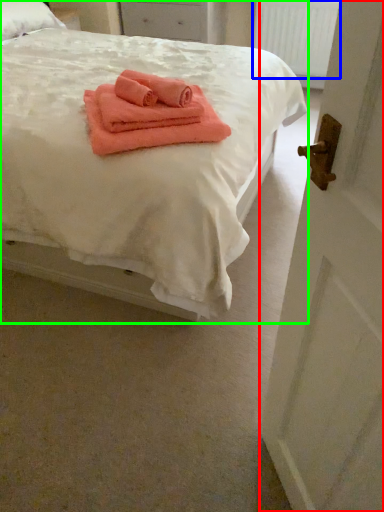
Question: Estimate the real-world distances between objects in this image. Which object is closer to door (highlighted by a red box), radiator (highlighted by a blue box) or bed (highlighted by a green box)?

Choices:
 (A) radiator
 (B) bed

Answer: (B)